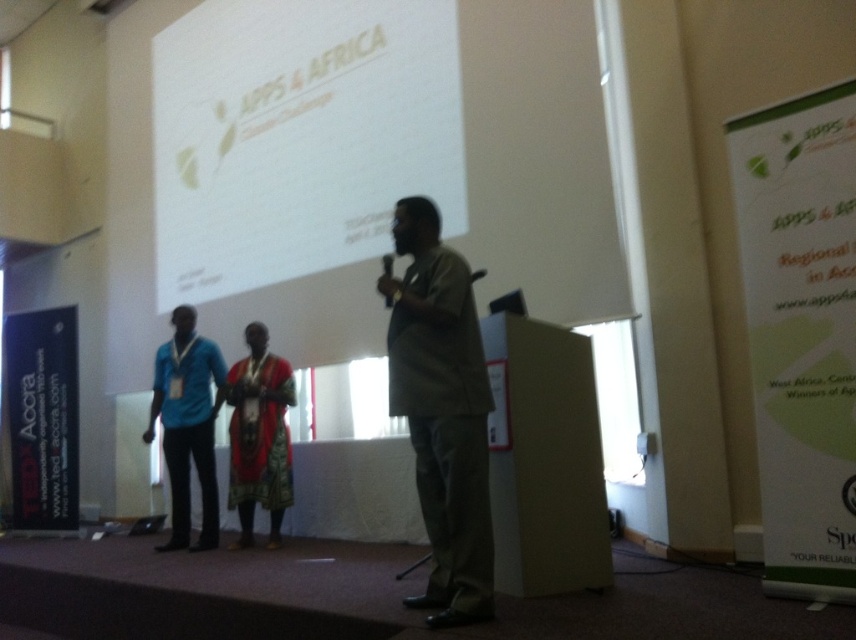
Question: Which point is closer to the camera?

Choices:
 (A) (284, 406)
 (B) (257, 202)

Answer: (A)

Question: Considering the real-world distances, which object is farthest from the blue fabric shirt at left?

Choices:
 (A) green fabric shirt at center
 (B) textured red dress at center
 (C) white matte projection screen at upper center

Answer: (A)

Question: In this image, where is white matte projection screen at upper center located relative to textured red dress at center?

Choices:
 (A) right
 (B) left

Answer: (B)

Question: Which of these objects is positioned closest to the blue fabric shirt at left?

Choices:
 (A) textured red dress at center
 (B) white matte projection screen at upper center
 (C) green fabric shirt at center

Answer: (A)

Question: Does green fabric shirt at center appear on the left side of blue fabric shirt at left?

Choices:
 (A) yes
 (B) no

Answer: (B)

Question: Can you confirm if green fabric shirt at center is thinner than textured red dress at center?

Choices:
 (A) no
 (B) yes

Answer: (B)